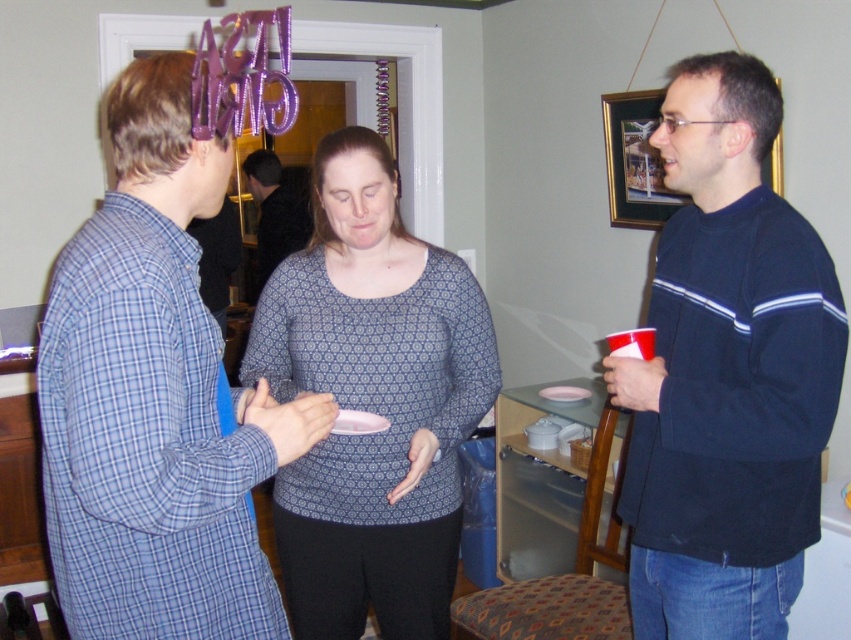
Is the position of blue plaid pajama at left more distant than that of dark blue sweater at right?

That is False.

The width and height of the screenshot is (851, 640). Find the location of `blue plaid pajama at left`. blue plaid pajama at left is located at coordinates (155, 397).

Does point (260, 440) come farther from viewer compared to point (801, 403)?

That is False.

Where is `blue plaid pajama at left`? blue plaid pajama at left is located at coordinates (155, 397).

Is the position of blue plaid pajama at left more distant than that of patterned fabric blouse at center?

That is False.

Between point (43, 401) and point (437, 470), which one is positioned in front?

Point (43, 401)

This screenshot has width=851, height=640. In order to click on blue plaid pajama at left in this screenshot , I will do `click(155, 397)`.

Between point (397, 273) and point (352, 420), which one is positioned behind?

Positioned behind is point (397, 273).

Which of these two, patterned fabric blouse at center or white paper plate at center, stands taller?

Standing taller between the two is patterned fabric blouse at center.

Which is in front, point (443, 422) or point (386, 424)?

Point (386, 424) is in front.

Identify the location of patterned fabric blouse at center. (372, 403).